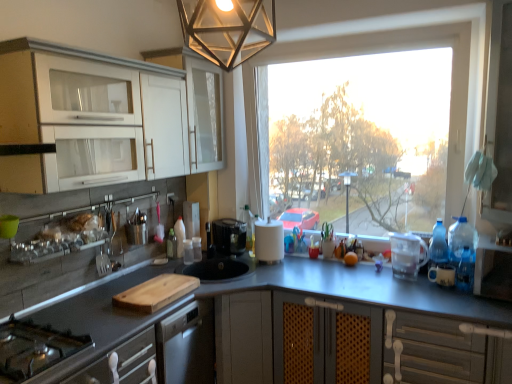
Where is `vacant space in front of orange matte at counter`? vacant space in front of orange matte at counter is located at coordinates (358, 276).